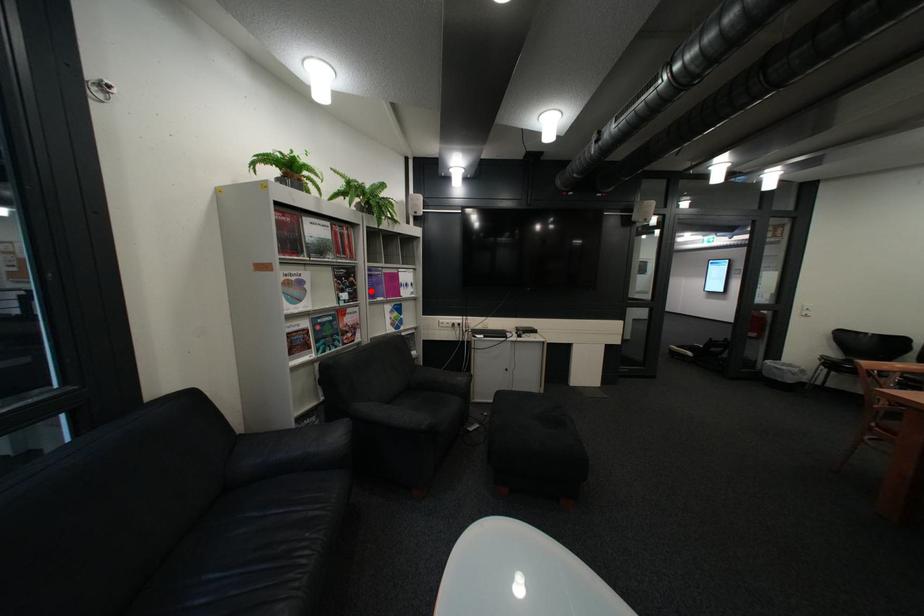
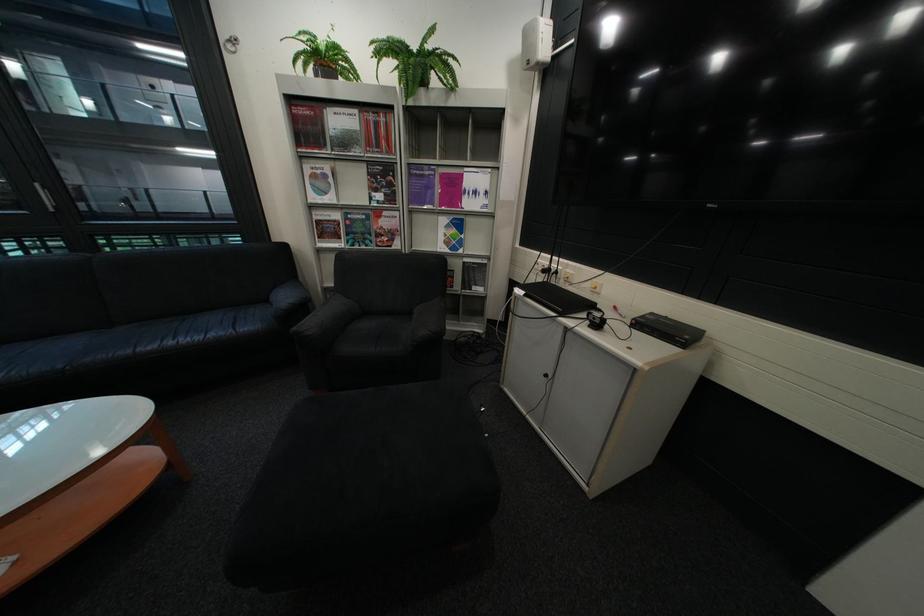
Where in the second image is the point corresponding to the highlighted location from the first image?

(409, 192)